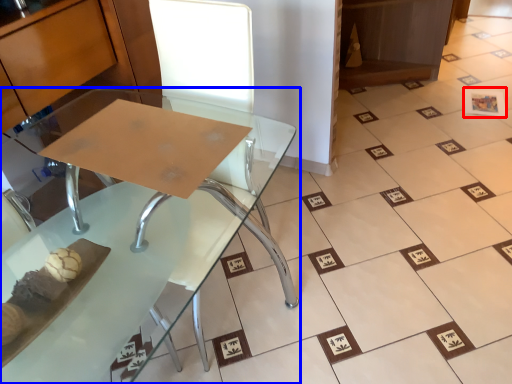
Question: Which of the following is the farthest to the observer, square (highlighted by a red box) or table (highlighted by a blue box)?

Choices:
 (A) square
 (B) table

Answer: (A)